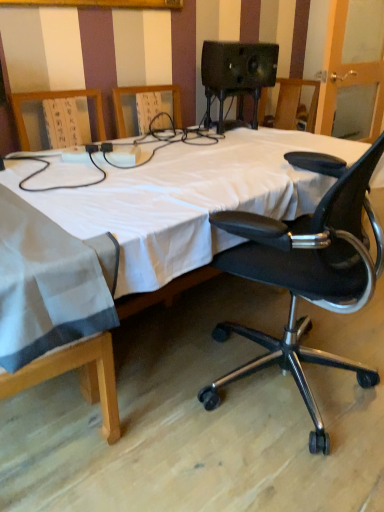
At what (x,y) coordinates should I click in order to perform the action: click on free space to the left of black matte office chair at right. Please return your answer as a coordinate pair (x, y). The height and width of the screenshot is (512, 384). Looking at the image, I should click on 180,403.